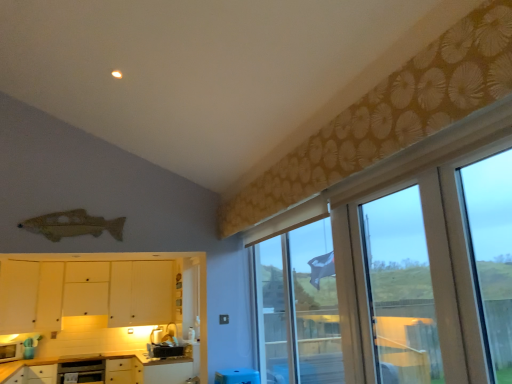
The width and height of the screenshot is (512, 384). What do you see at coordinates (11, 352) in the screenshot? I see `white glossy microwave at lower left, the first appliance viewed from the left` at bounding box center [11, 352].

The height and width of the screenshot is (384, 512). What are the coordinates of `translucent glass window at upper right` in the screenshot? It's located at (300, 306).

Find the location of a particular element. transparent plastic screen door at right is located at coordinates (401, 290).

Between white glossy microwave at lower left, placed as the second appliance when sorted from right to left, and white matte cabinet at lower left, which ranks as the 3th cabinetry in top-to-bottom order, which one has larger width?

With larger width is white matte cabinet at lower left, which ranks as the 3th cabinetry in top-to-bottom order.

Is white glossy microwave at lower left, placed as the second appliance when sorted from right to left, positioned beyond the bounds of white matte cabinet at lower left, which ranks as the 3th cabinetry in top-to-bottom order?

Absolutely, white glossy microwave at lower left, placed as the second appliance when sorted from right to left, is external to white matte cabinet at lower left, which ranks as the 3th cabinetry in top-to-bottom order.

Does point (9, 355) come behind point (109, 358)?

No, (9, 355) is closer to viewer.

From a real-world perspective, between matte black toaster at lower center, which appears as the 2th appliance when viewed from the left, and white matte cabinet at lower left, which appears as the first cabinetry when ordered from the bottom, who is vertically higher?

matte black toaster at lower center, which appears as the 2th appliance when viewed from the left, is physically above.

Is matte black toaster at lower center, the first appliance viewed from the right, located outside white matte cabinet at lower left, which ranks as the 3th cabinetry in top-to-bottom order?

matte black toaster at lower center, the first appliance viewed from the right, is positioned outside white matte cabinet at lower left, which ranks as the 3th cabinetry in top-to-bottom order.

Consider the image. Is matte black toaster at lower center, which appears as the 2th appliance when viewed from the left, turned away from white matte cabinet at lower left, which ranks as the 3th cabinetry in top-to-bottom order?

matte black toaster at lower center, which appears as the 2th appliance when viewed from the left, does not have its back to white matte cabinet at lower left, which ranks as the 3th cabinetry in top-to-bottom order.

Does matte black toaster at lower center, which appears as the 2th appliance when viewed from the left, have a greater height compared to white matte cabinet at lower left, which appears as the first cabinetry when ordered from the bottom?

No, matte black toaster at lower center, which appears as the 2th appliance when viewed from the left, is not taller than white matte cabinet at lower left, which appears as the first cabinetry when ordered from the bottom.

Considering the relative sizes of white matte cabinet at lower left, which is counted as the first cabinetry, starting from the top, and white matte cabinet at lower left, which ranks as the 3th cabinetry in top-to-bottom order, in the image provided, is white matte cabinet at lower left, which is counted as the first cabinetry, starting from the top, shorter than white matte cabinet at lower left, which ranks as the 3th cabinetry in top-to-bottom order,?

Incorrect, the height of white matte cabinet at lower left, which is counted as the first cabinetry, starting from the top, does not fall short of that of white matte cabinet at lower left, which ranks as the 3th cabinetry in top-to-bottom order.

From the picture: Is white matte cabinet at lower left, which is counted as the first cabinetry, starting from the top, completely or partially outside of white matte cabinet at lower left, which appears as the first cabinetry when ordered from the bottom?

white matte cabinet at lower left, which is counted as the first cabinetry, starting from the top, is positioned outside white matte cabinet at lower left, which appears as the first cabinetry when ordered from the bottom.

Considering the relative sizes of white glossy microwave at lower left, the first appliance viewed from the left, and white matte cabinet at lower left, which ranks as the third cabinetry in bottom-to-top order, in the image provided, is white glossy microwave at lower left, the first appliance viewed from the left, bigger than white matte cabinet at lower left, which ranks as the third cabinetry in bottom-to-top order,?

Incorrect, white glossy microwave at lower left, the first appliance viewed from the left, is not larger than white matte cabinet at lower left, which ranks as the third cabinetry in bottom-to-top order.

Is white glossy microwave at lower left, the first appliance viewed from the left, not close to white matte cabinet at lower left, which is counted as the first cabinetry, starting from the top?

white glossy microwave at lower left, the first appliance viewed from the left, is far away from white matte cabinet at lower left, which is counted as the first cabinetry, starting from the top.

Between white glossy microwave at lower left, the first appliance viewed from the left, and white matte cabinet at lower left, which ranks as the third cabinetry in bottom-to-top order, which one is positioned in front?

Positioned in front is white matte cabinet at lower left, which ranks as the third cabinetry in bottom-to-top order.

Is white glossy microwave at lower left, placed as the second appliance when sorted from right to left, facing towards white matte cabinet at lower left, which is counted as the first cabinetry, starting from the top?

No, white glossy microwave at lower left, placed as the second appliance when sorted from right to left, is not facing towards white matte cabinet at lower left, which is counted as the first cabinetry, starting from the top.

Which object is closer to the camera taking this photo, transparent plastic screen door at right or matte black toaster at lower center, the first appliance viewed from the right?

transparent plastic screen door at right is more forward.

Is point (430, 300) positioned behind point (160, 343)?

No.

Is transparent plastic screen door at right in contact with matte black toaster at lower center, the first appliance viewed from the right?

transparent plastic screen door at right and matte black toaster at lower center, the first appliance viewed from the right, are not in contact.

Does transparent plastic screen door at right contain matte black toaster at lower center, the first appliance viewed from the right?

No, matte black toaster at lower center, the first appliance viewed from the right, is not surrounded by transparent plastic screen door at right.

Is white glossy table at lower center completely or partially outside of white glossy microwave at lower left, placed as the second appliance when sorted from right to left?

That's correct, white glossy table at lower center is outside of white glossy microwave at lower left, placed as the second appliance when sorted from right to left.

Looking at their sizes, would you say white glossy table at lower center is wider or thinner than white glossy microwave at lower left, the first appliance viewed from the left?

Considering their sizes, white glossy table at lower center looks broader than white glossy microwave at lower left, the first appliance viewed from the left.

This screenshot has height=384, width=512. I want to click on the 2nd appliance behind when counting from the white glossy table at lower center, so click(x=11, y=352).

Is white glossy table at lower center taller than white glossy microwave at lower left, the first appliance viewed from the left?

Correct, white glossy table at lower center is much taller as white glossy microwave at lower left, the first appliance viewed from the left.

Which is behind, point (108, 311) or point (267, 263)?

Point (108, 311)

From the picture: Between white matte cabinet at lower left, which ranks as the third cabinetry in bottom-to-top order, and translucent glass window at upper right, which one appears on the right side from the viewer's perspective?

translucent glass window at upper right is more to the right.

Between white matte cabinet at lower left, which ranks as the third cabinetry in bottom-to-top order, and translucent glass window at upper right, which one has more height?

With more height is translucent glass window at upper right.

Is white matte cabinet at lower left, which ranks as the third cabinetry in bottom-to-top order, looking in the opposite direction of translucent glass window at upper right?

No, translucent glass window at upper right is not at the back of white matte cabinet at lower left, which ranks as the third cabinetry in bottom-to-top order.

There is a white matte cabinet at lower left, which ranks as the 3th cabinetry in top-to-bottom order. At what (x,y) coordinates should I click in order to perform the action: click on the 1st appliance above it (from the image's perspective). Please return your answer as a coordinate pair (x, y). This screenshot has height=384, width=512. Looking at the image, I should click on (11, 352).

Identify the location of the 1st appliance directly above the white matte cabinet at lower left, which ranks as the 3th cabinetry in top-to-bottom order (from a real-world perspective). This screenshot has height=384, width=512. (164, 350).

From the image, which object appears to be farther from white matte cabinet at lower left, which ranks as the third cabinetry in bottom-to-top order, transparent plastic screen door at right or white matte cabinet at lower left, the 2th cabinetry from the bottom?

Based on the image, transparent plastic screen door at right appears to be further to white matte cabinet at lower left, which ranks as the third cabinetry in bottom-to-top order.

Considering their positions, is metallic silver oven at lower left positioned closer to white glossy microwave at lower left, the first appliance viewed from the left, than white glossy table at lower center?

metallic silver oven at lower left.

From the image, which object appears to be farther from white matte cabinet at lower left, which ranks as the third cabinetry in bottom-to-top order, metallic silver oven at lower left or matte black toaster at lower center, which appears as the 2th appliance when viewed from the left?

matte black toaster at lower center, which appears as the 2th appliance when viewed from the left, is further to white matte cabinet at lower left, which ranks as the third cabinetry in bottom-to-top order.

Which object lies nearer to the anchor point white matte cabinet at lower left, which ranks as the 3th cabinetry in top-to-bottom order, white glossy table at lower center or matte black toaster at lower center, which appears as the 2th appliance when viewed from the left?

Among the two, white glossy table at lower center is located nearer to white matte cabinet at lower left, which ranks as the 3th cabinetry in top-to-bottom order.

Estimate the real-world distances between objects in this image. Which object is further from white matte cabinet at lower left, which is counted as the first cabinetry, starting from the top, white glossy table at lower center or white matte cabinet at lower left, arranged as the 2th cabinetry when viewed from the top?

white glossy table at lower center lies further to white matte cabinet at lower left, which is counted as the first cabinetry, starting from the top, than the other object.

Estimate the real-world distances between objects in this image. Which object is closer to translucent glass window at upper right, white glossy microwave at lower left, the first appliance viewed from the left, or white matte cabinet at lower left, arranged as the 2th cabinetry when viewed from the top?

white glossy microwave at lower left, the first appliance viewed from the left, is positioned closer to the anchor translucent glass window at upper right.

Looking at the image, which one is located closer to metallic silver oven at lower left, transparent plastic screen door at right or white matte cabinet at lower left, arranged as the 2th cabinetry when viewed from the top?

white matte cabinet at lower left, arranged as the 2th cabinetry when viewed from the top.

Based on their spatial positions, is white matte cabinet at lower left, arranged as the 2th cabinetry when viewed from the top, or white glossy microwave at lower left, the first appliance viewed from the left, closer to metallic silver oven at lower left?

white glossy microwave at lower left, the first appliance viewed from the left.

At what (x,y) coordinates should I click in order to perform the action: click on kitchen appliance between white matte cabinet at lower left, the 2th cabinetry from the bottom, and matte black toaster at lower center, which appears as the 2th appliance when viewed from the left. Please return your answer as a coordinate pair (x, y). The height and width of the screenshot is (384, 512). Looking at the image, I should click on 82,371.

Locate an element on the screen. The image size is (512, 384). appliance between white matte cabinet at lower left, which ranks as the 3th cabinetry in top-to-bottom order, and white glossy microwave at lower left, the first appliance viewed from the left, from front to back is located at coordinates (164, 350).

Locate an element on the screen. This screenshot has width=512, height=384. table positioned between transparent plastic screen door at right and white matte cabinet at lower left, the 2th cabinetry from the bottom, from near to far is located at coordinates (162, 370).

You are a GUI agent. You are given a task and a screenshot of the screen. Output one action in this format:
    pyautogui.click(x=<x>, y=<y>)
    Task: Click on the table between white matte cabinet at lower left, which ranks as the 3th cabinetry in top-to-bottom order, and white glossy microwave at lower left, the first appliance viewed from the left, along the z-axis
    The height and width of the screenshot is (384, 512).
    Given the screenshot: What is the action you would take?
    pyautogui.click(x=162, y=370)